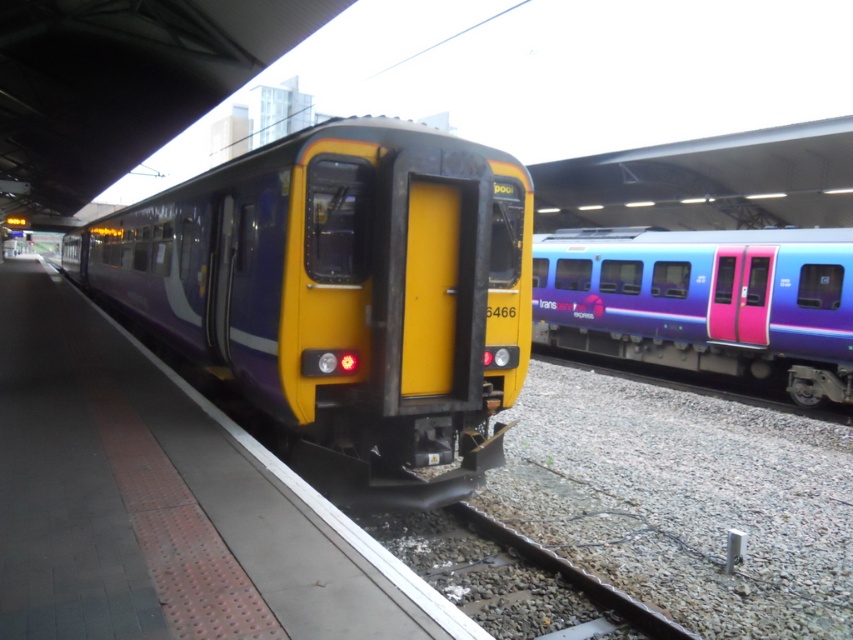
Question: Which object appears closest to the camera in this image?

Choices:
 (A) matte purple train at center
 (B) purple glossy platform at center
 (C) blue glossy train at right

Answer: (B)

Question: In this image, where is matte purple train at center located relative to purple glossy platform at center?

Choices:
 (A) right
 (B) left

Answer: (B)

Question: Which object is positioned farthest from the matte purple train at center?

Choices:
 (A) purple glossy platform at center
 (B) blue glossy train at right
 (C) gravel at center

Answer: (B)

Question: Which object appears closest to the camera in this image?

Choices:
 (A) gravel at center
 (B) matte purple train at center
 (C) purple glossy platform at center
 (D) blue glossy train at right

Answer: (C)

Question: Does matte purple train at center appear under gravel at center?

Choices:
 (A) yes
 (B) no

Answer: (B)

Question: Observing the image, what is the correct spatial positioning of purple glossy platform at center in reference to blue glossy train at right?

Choices:
 (A) left
 (B) right

Answer: (A)